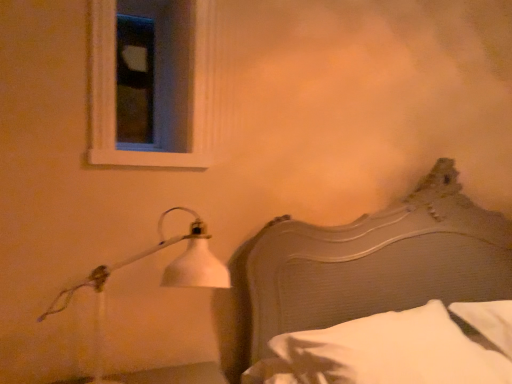
Question: From the image's perspective, does white matte lamp at left appear higher than white wood frame at upper left?

Choices:
 (A) yes
 (B) no

Answer: (B)

Question: Considering the relative positions of white matte lamp at left and white wood frame at upper left in the image provided, is white matte lamp at left to the right of white wood frame at upper left from the viewer's perspective?

Choices:
 (A) no
 (B) yes

Answer: (B)

Question: Considering the relative sizes of white matte lamp at left and white wood frame at upper left in the image provided, is white matte lamp at left wider than white wood frame at upper left?

Choices:
 (A) yes
 (B) no

Answer: (A)

Question: Is white matte lamp at left directly adjacent to white wood frame at upper left?

Choices:
 (A) no
 (B) yes

Answer: (A)

Question: Would you say white matte lamp at left is outside white wood frame at upper left?

Choices:
 (A) yes
 (B) no

Answer: (A)

Question: From a real-world perspective, is white wood frame at upper left above or below wooden headboard at right?

Choices:
 (A) below
 (B) above

Answer: (B)

Question: Considering their positions, is white wood frame at upper left located in front of or behind wooden headboard at right?

Choices:
 (A) behind
 (B) front

Answer: (A)

Question: From the image's perspective, is white wood frame at upper left above or below wooden headboard at right?

Choices:
 (A) above
 (B) below

Answer: (A)

Question: In terms of width, does white wood frame at upper left look wider or thinner when compared to wooden headboard at right?

Choices:
 (A) wide
 (B) thin

Answer: (B)

Question: In terms of height, does white soft pillow at lower right look taller or shorter compared to white wood frame at upper left?

Choices:
 (A) short
 (B) tall

Answer: (A)

Question: Looking at the image, does white soft pillow at lower right seem bigger or smaller compared to white wood frame at upper left?

Choices:
 (A) big
 (B) small

Answer: (A)

Question: From a real-world perspective, is white soft pillow at lower right above or below white wood frame at upper left?

Choices:
 (A) above
 (B) below

Answer: (B)

Question: In the image, is white soft pillow at lower right positioned in front of or behind white wood frame at upper left?

Choices:
 (A) behind
 (B) front

Answer: (B)

Question: From the image's perspective, is white matte lamp at left above or below white soft pillow at lower right?

Choices:
 (A) above
 (B) below

Answer: (A)

Question: From a real-world perspective, relative to white soft pillow at lower right, is white matte lamp at left vertically above or below?

Choices:
 (A) above
 (B) below

Answer: (A)